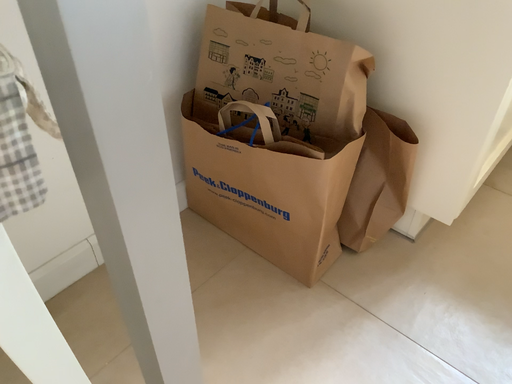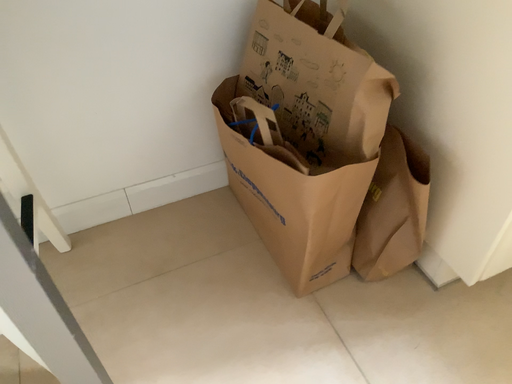
Question: How did the camera likely rotate when shooting the video?

Choices:
 (A) rotated left
 (B) rotated right

Answer: (A)